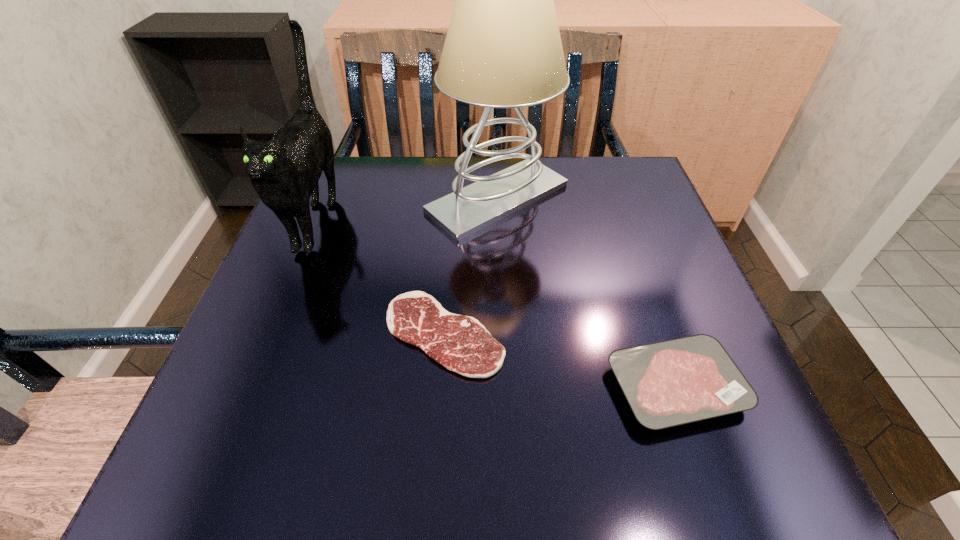
Locate an element on the screen. The height and width of the screenshot is (540, 960). vacant area that lies between the shortest object and the cat is located at coordinates (381, 276).

In order to click on empty space between the left steak and the right steak in this screenshot , I will do `click(560, 360)`.

Where is `unoccupied area between the taller steak and the tallest object`? The image size is (960, 540). unoccupied area between the taller steak and the tallest object is located at coordinates (587, 292).

Locate an element on the screen. This screenshot has width=960, height=540. vacant space that is in between the right steak and the table lamp is located at coordinates (587, 292).

I want to click on free space between the third tallest object and the table lamp, so click(587, 292).

At what (x,y) coordinates should I click in order to perform the action: click on the closest object to the table lamp. Please return your answer as a coordinate pair (x, y). This screenshot has height=540, width=960. Looking at the image, I should click on (460, 343).

This screenshot has height=540, width=960. I want to click on object that can be found as the closest to the leftmost object, so click(x=460, y=343).

At what (x,y) coordinates should I click in order to perform the action: click on free spot that satisfies the following two spatial constraints: 1. on the front side of the second shortest object; 2. on the right side of the shortest object. Please return your answer as a coordinate pair (x, y). The image size is (960, 540). Looking at the image, I should click on (441, 387).

Find the location of a particular element. This screenshot has height=540, width=960. blank area in the image that satisfies the following two spatial constraints: 1. on the front side of the right steak; 2. on the left side of the shortest object is located at coordinates (441, 387).

Identify the location of vacant region that satisfies the following two spatial constraints: 1. on the face of the right steak; 2. on the left side of the cat. This screenshot has height=540, width=960. (250, 387).